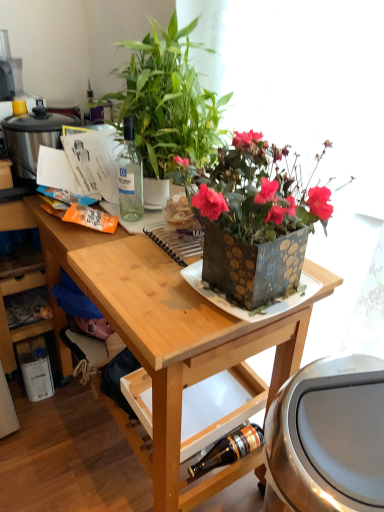
The width and height of the screenshot is (384, 512). I want to click on vacant space positioned to the left of metallic square plate at center, so click(154, 286).